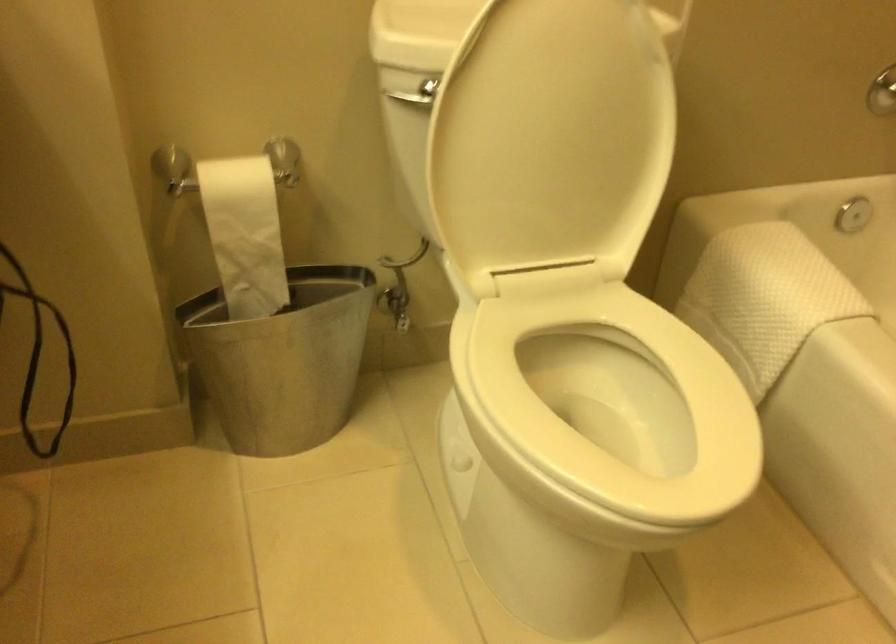
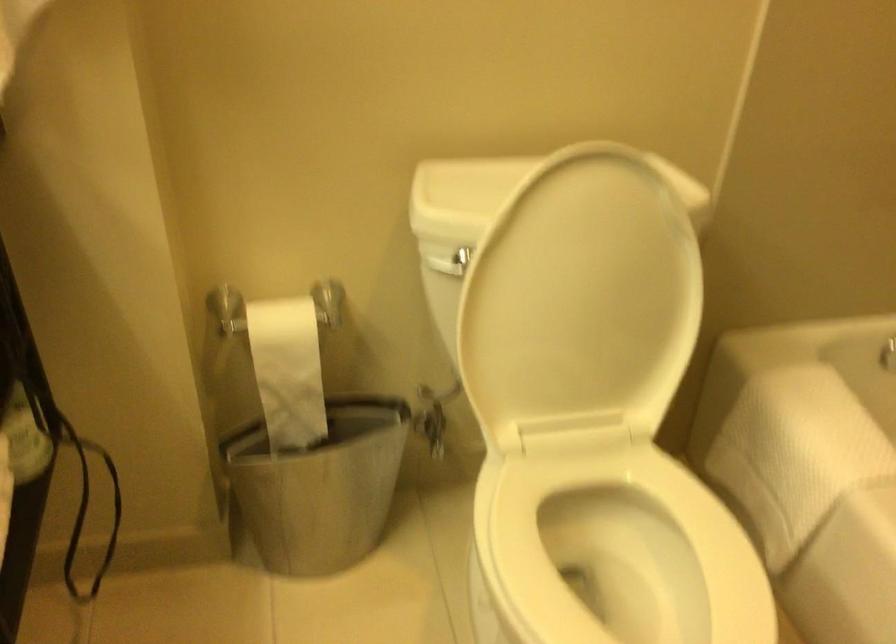
Question: The first image is from the beginning of the video and the second image is from the end. How did the camera likely rotate when shooting the video?

Choices:
 (A) Left
 (B) Right
 (C) Up
 (D) Down

Answer: (A)